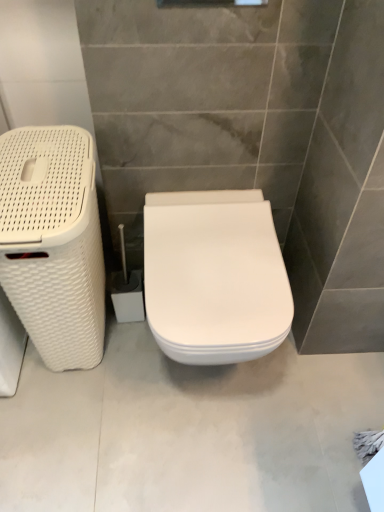
Question: From a real-world perspective, is white woven laundry basket at left positioned above or below white glossy toilet at center?

Choices:
 (A) above
 (B) below

Answer: (A)

Question: Is white woven laundry basket at left spatially inside white glossy toilet at center, or outside of it?

Choices:
 (A) inside
 (B) outside

Answer: (B)

Question: Which is farther from the white glossy toilet at center?

Choices:
 (A) white glossy toilet at center
 (B) white woven laundry basket at left

Answer: (A)

Question: Which object is positioned farthest from the white woven laundry basket at left?

Choices:
 (A) white glossy toilet at center
 (B) white glossy toilet at center

Answer: (B)